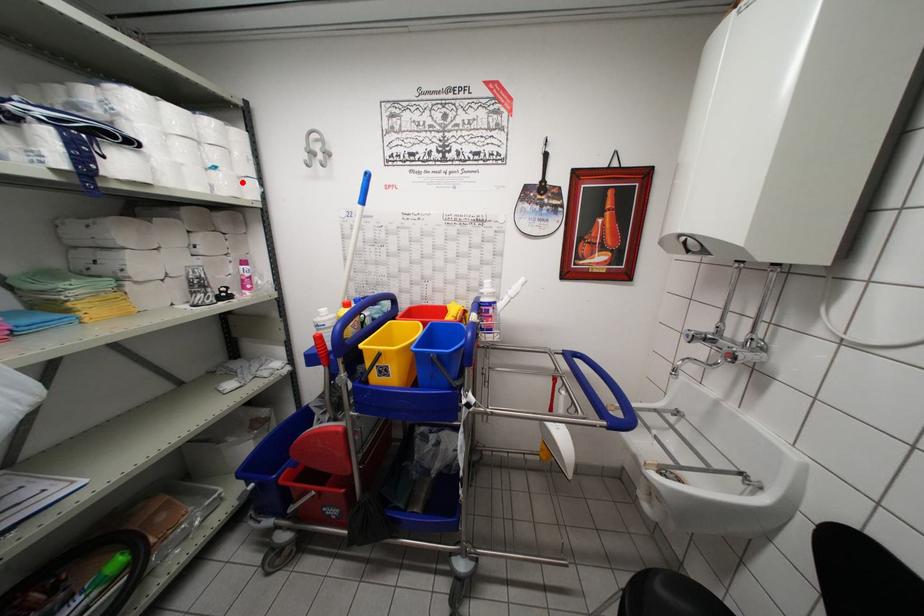
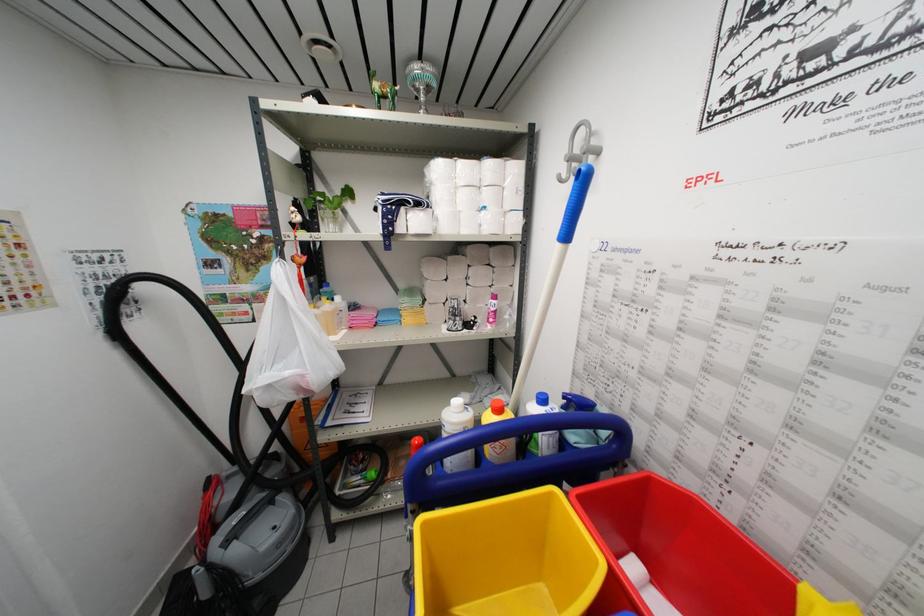
Where in the second image is the point corresponding to the highlighted location from the first image?

(507, 217)